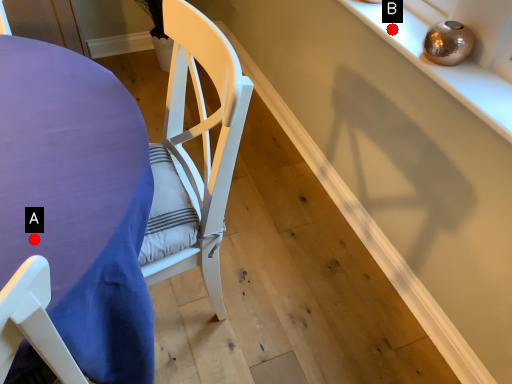
Question: Two points are circled on the image, labeled by A and B beside each circle. Which of the following is the closest to the observer?

Choices:
 (A) A is closer
 (B) B is closer

Answer: (A)